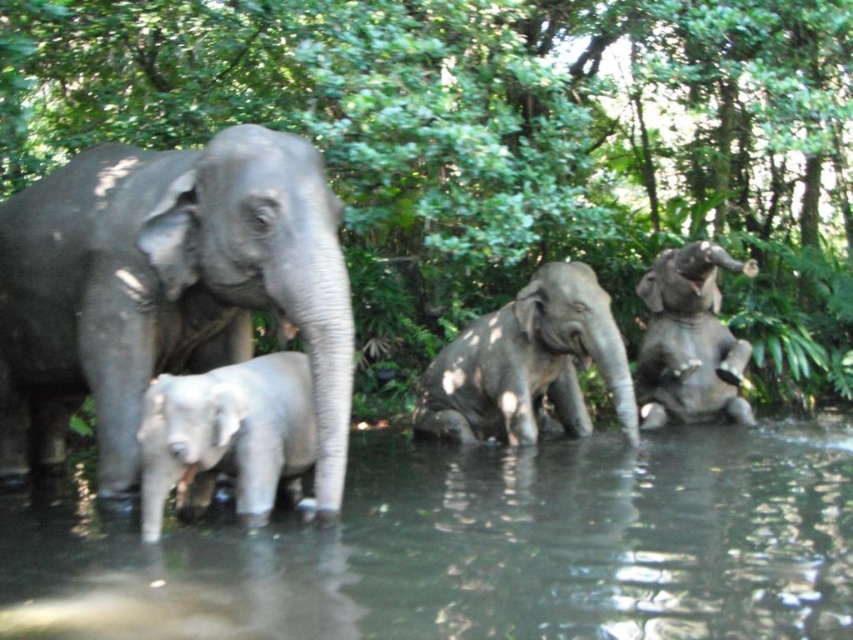
Is gray matte elephant at left to the left of gray matte elephant at center from the viewer's perspective?

Correct, you'll find gray matte elephant at left to the left of gray matte elephant at center.

Who is more distant from viewer, (112, 163) or (462, 333)?

The point (462, 333) is behind.

This screenshot has height=640, width=853. What are the coordinates of `gray matte elephant at left` in the screenshot? It's located at (165, 291).

Is point (460, 582) positioned after point (550, 323)?

No, (460, 582) is closer to viewer.

I want to click on clear water at creek left, so click(x=480, y=548).

Is point (809, 493) farther from viewer compared to point (432, 417)?

No, it is in front of (432, 417).

You are a GUI agent. You are given a task and a screenshot of the screen. Output one action in this format:
    pyautogui.click(x=<x>, y=<y>)
    Task: Click on the clear water at creek left
    The image size is (853, 640).
    Given the screenshot: What is the action you would take?
    pyautogui.click(x=480, y=548)

Does gray matte elephant at left have a greater width compared to gray matte elephant at right?

Yes.

Who is more distant from viewer, (248,289) or (647,396)?

Positioned behind is point (647,396).

You are a GUI agent. You are given a task and a screenshot of the screen. Output one action in this format:
    pyautogui.click(x=<x>, y=<y>)
    Task: Click on the gray matte elephant at left
    
    Given the screenshot: What is the action you would take?
    pyautogui.click(x=165, y=291)